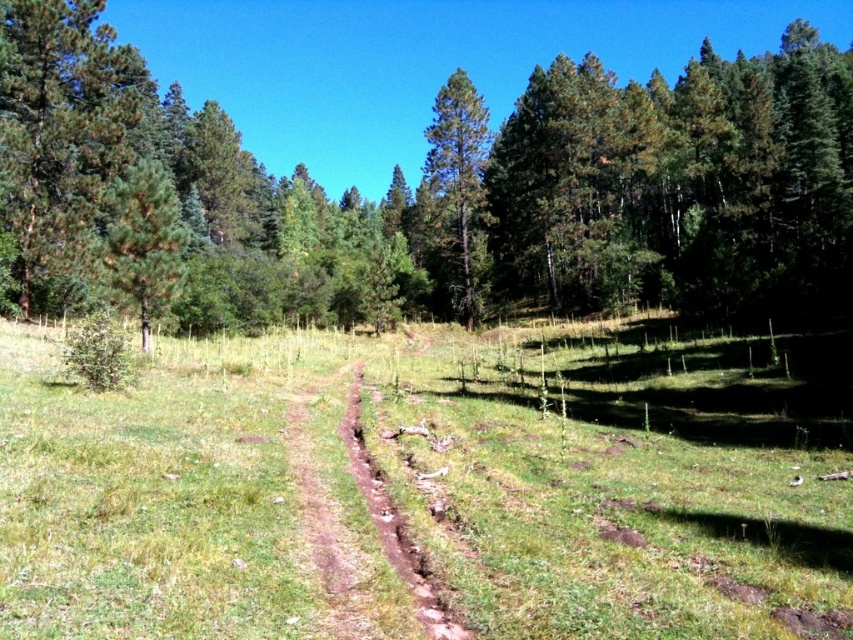
You are a hiker navigating a narrow dirt path in a forest. You notice the green leafy forest at center and the green matte tree at center. Which of these two has a greater width?

The green leafy forest at center has a greater width than the green matte tree at center, as stated in the description.

You are a hiker trying to find the tallest object in the forest. You see the green leafy forest at center and the green matte tree at center. Which one is taller?

The green leafy forest at center is taller than the green matte tree at center.

You are a hiker trying to cross the forest. You see the green grassy at center and the green leafy forest at center. Which area would allow you to walk more easily?

The green grassy at center has a smaller width than the green leafy forest at center, so the grassy area would be easier to walk through since it is narrower and less obstructed.